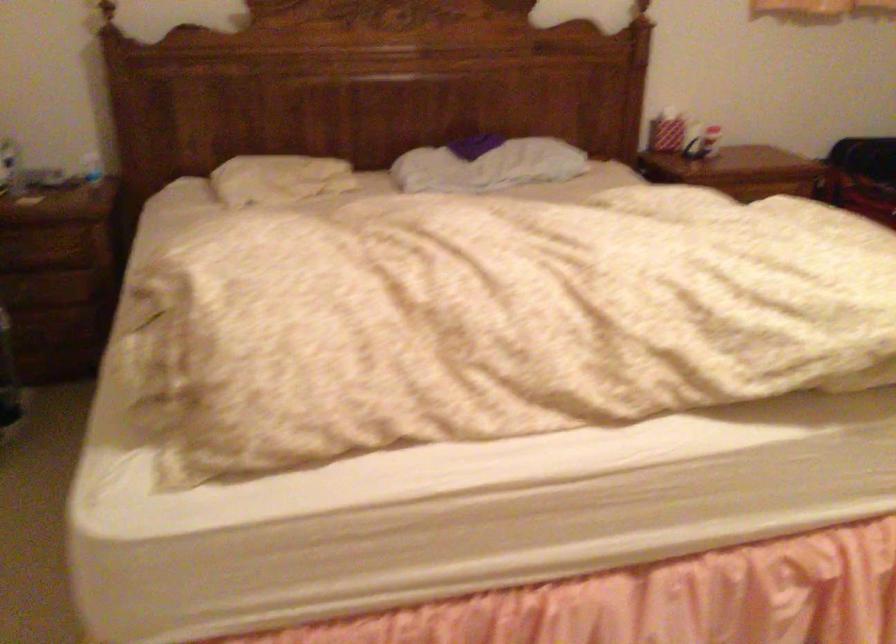
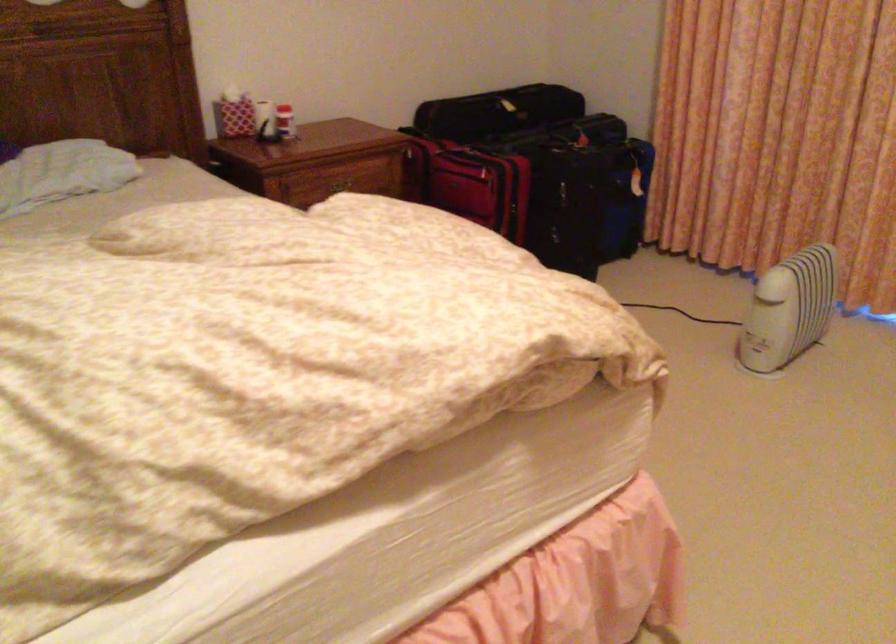
Question: Based on the continuous images, in which direction is the camera rotating? Reply with the corresponding letter.

Choices:
 (A) Left
 (B) Right
 (C) Up
 (D) Down

Answer: (B)